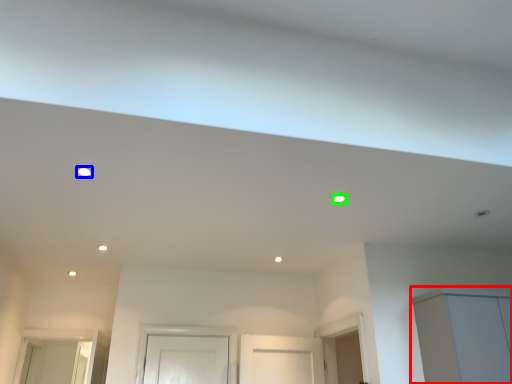
Question: Estimate the real-world distances between objects in this image. Which object is closer to cabinetry (highlighted by a red box), lighting (highlighted by a blue box) or lighting (highlighted by a green box)?

Choices:
 (A) lighting
 (B) lighting

Answer: (B)